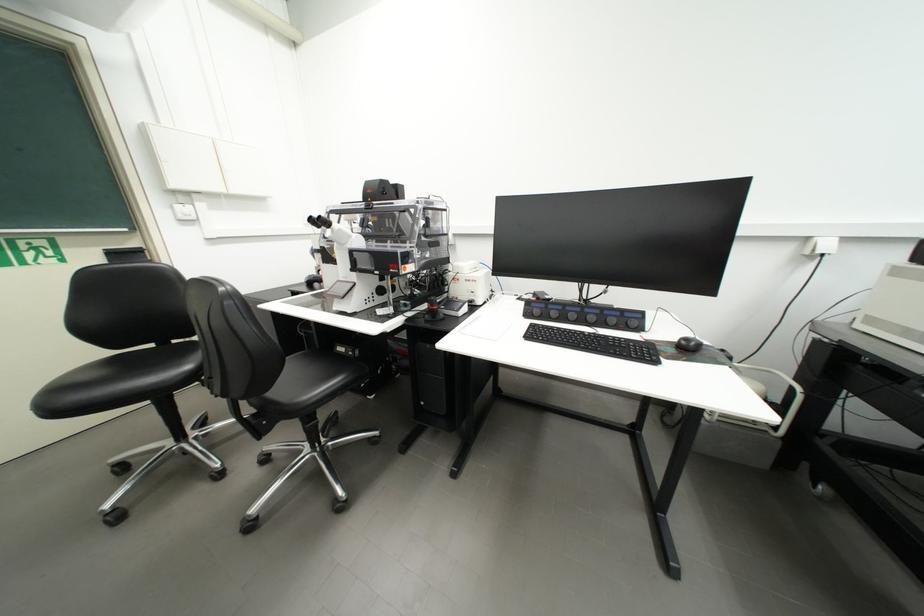
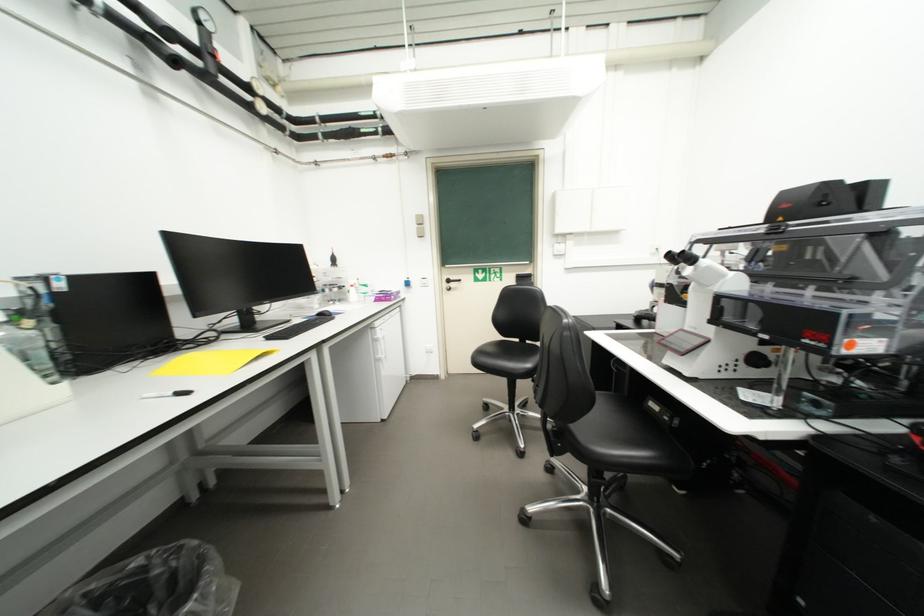
Where in the second image is the point corresponding to pixel 327 224 from the first image?

(687, 259)